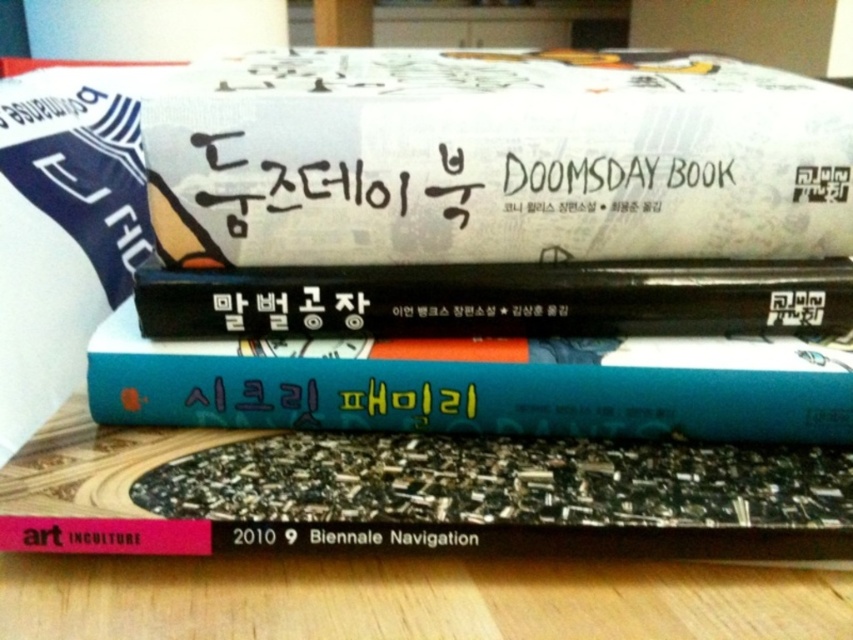
Is the position of blue matte book at center less distant than that of black matte book at center?

Yes, blue matte book at center is closer to the viewer.

Can you confirm if blue matte book at center is wider than black matte book at center?

Indeed, blue matte book at center has a greater width compared to black matte book at center.

At what (x,y) coordinates should I click in order to perform the action: click on blue matte book at center. Please return your answer as a coordinate pair (x, y). Looking at the image, I should click on (479, 385).

Where is `blue matte book at center`? blue matte book at center is located at coordinates (479, 385).

Between black textured book at center and blue matte book at center, which one has less height?

black textured book at center is shorter.

Does black textured book at center appear on the left side of blue matte book at center?

Yes, black textured book at center is to the left of blue matte book at center.

This screenshot has width=853, height=640. What do you see at coordinates (416, 493) in the screenshot? I see `black textured book at center` at bounding box center [416, 493].

At what (x,y) coordinates should I click in order to perform the action: click on black textured book at center. Please return your answer as a coordinate pair (x, y). The height and width of the screenshot is (640, 853). Looking at the image, I should click on (416, 493).

Is white paper book at center bigger than black textured book at center?

Indeed, white paper book at center has a larger size compared to black textured book at center.

Is white paper book at center smaller than black textured book at center?

No.

You are a GUI agent. You are given a task and a screenshot of the screen. Output one action in this format:
    pyautogui.click(x=<x>, y=<y>)
    Task: Click on the white paper book at center
    
    Given the screenshot: What is the action you would take?
    pyautogui.click(x=492, y=157)